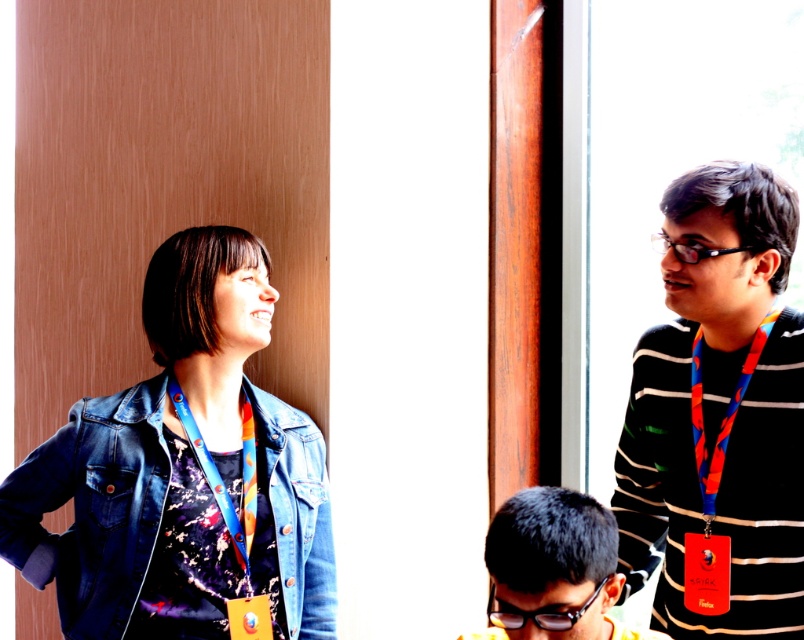
Is striped sweater at right bigger than blue fabric lanyard at left?

Correct, striped sweater at right is larger in size than blue fabric lanyard at left.

In the scene shown: Does striped sweater at right appear under blue fabric lanyard at left?

Actually, striped sweater at right is above blue fabric lanyard at left.

Is point (741, 364) farther from viewer compared to point (248, 458)?

That is False.

What are the coordinates of `striped sweater at right` in the screenshot? It's located at (718, 417).

Who is shorter, black textured hair at lower center or blue fabric lanyard at left?

black textured hair at lower center is shorter.

Is black textured hair at lower center to the right of blue fabric lanyard at left from the viewer's perspective?

Yes, black textured hair at lower center is to the right of blue fabric lanyard at left.

Who is more forward, (595, 586) or (248, 576)?

Point (595, 586) is more forward.

Image resolution: width=804 pixels, height=640 pixels. I want to click on black textured hair at lower center, so click(x=554, y=568).

Is striped sweater at right closer to camera compared to denim jacket at left?

Yes, it is.

Who is shorter, striped sweater at right or denim jacket at left?

denim jacket at left

Where is `striped sweater at right`? Image resolution: width=804 pixels, height=640 pixels. striped sweater at right is located at coordinates (718, 417).

You are a GUI agent. You are given a task and a screenshot of the screen. Output one action in this format:
    pyautogui.click(x=<x>, y=<y>)
    Task: Click on the striped sweater at right
    
    Given the screenshot: What is the action you would take?
    pyautogui.click(x=718, y=417)